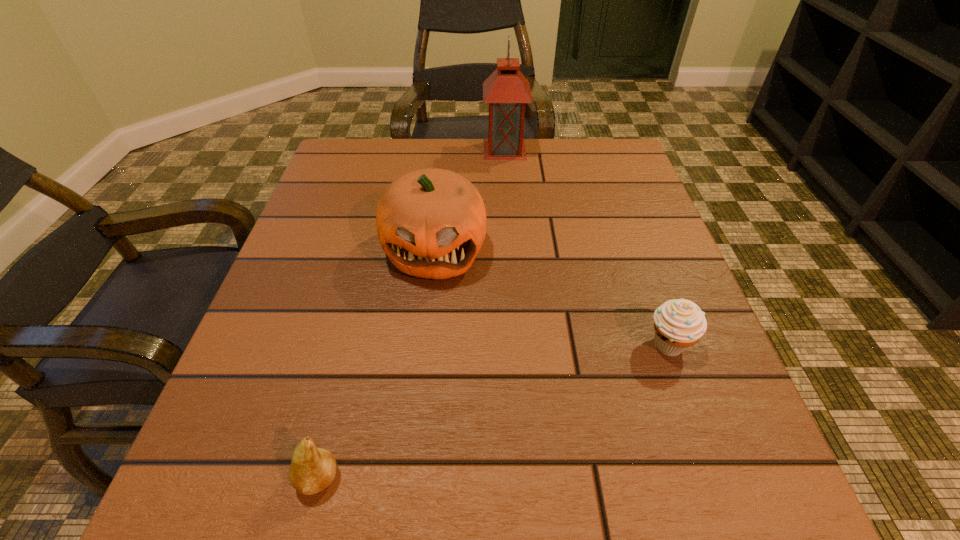
Where is `the farthest object`? The width and height of the screenshot is (960, 540). the farthest object is located at coordinates point(506,90).

At what (x,y) coordinates should I click in order to perform the action: click on the tallest object. Please return your answer as a coordinate pair (x, y). Looking at the image, I should click on (506, 90).

Find the location of a particular element. The image size is (960, 540). the second tallest object is located at coordinates (431, 223).

The height and width of the screenshot is (540, 960). Find the location of `pumpkin`. pumpkin is located at coordinates (431, 223).

This screenshot has height=540, width=960. I want to click on muffin, so click(678, 323).

The image size is (960, 540). Find the location of `the third farthest object`. the third farthest object is located at coordinates (678, 323).

What are the coordinates of `pear` in the screenshot? It's located at (312, 469).

Locate an element on the screen. The image size is (960, 540). free space located 0.080m on the left of the farthest object is located at coordinates (451, 150).

Image resolution: width=960 pixels, height=540 pixels. Find the location of `vacant region located on the face of the third nearest object`. vacant region located on the face of the third nearest object is located at coordinates 418,410.

This screenshot has height=540, width=960. What are the coordinates of `free space located on the front of the second nearest object` in the screenshot? It's located at (724, 503).